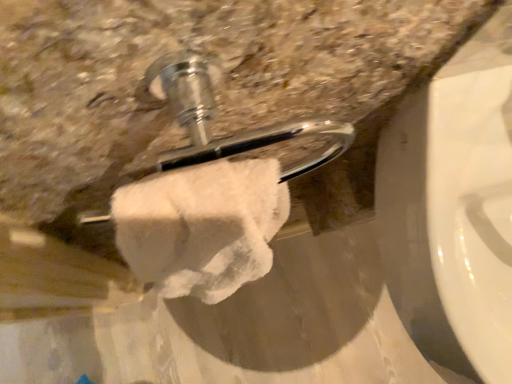
What do you see at coordinates (212, 190) in the screenshot?
I see `white fluffy towel at center` at bounding box center [212, 190].

What are the coordinates of `white fluffy towel at center` in the screenshot? It's located at (212, 190).

What is the approximate width of white fluffy towel at center?

white fluffy towel at center is 12.88 centimeters in width.

Where is `white fluffy towel at center`? The height and width of the screenshot is (384, 512). white fluffy towel at center is located at coordinates (212, 190).